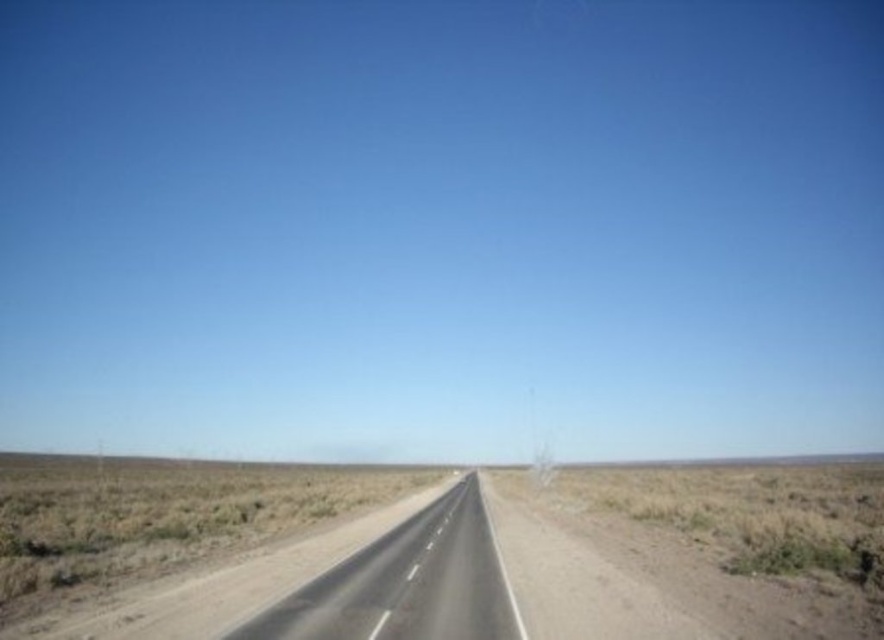
Question: Which point is closer to the camera taking this photo?

Choices:
 (A) (753, 460)
 (B) (428, 566)

Answer: (B)

Question: Does smooth asphalt highway at center appear on the left side of brown dirt at center?

Choices:
 (A) no
 (B) yes

Answer: (A)

Question: Among these points, which one is farthest from the camera?

Choices:
 (A) (311, 593)
 (B) (36, 461)

Answer: (B)

Question: Is smooth asphalt highway at center smaller than brown dirt at center?

Choices:
 (A) yes
 (B) no

Answer: (A)

Question: Is smooth asphalt highway at center positioned in front of brown dirt at center?

Choices:
 (A) no
 (B) yes

Answer: (B)

Question: Which of the following is the closest to the observer?

Choices:
 (A) (650, 461)
 (B) (359, 563)

Answer: (B)